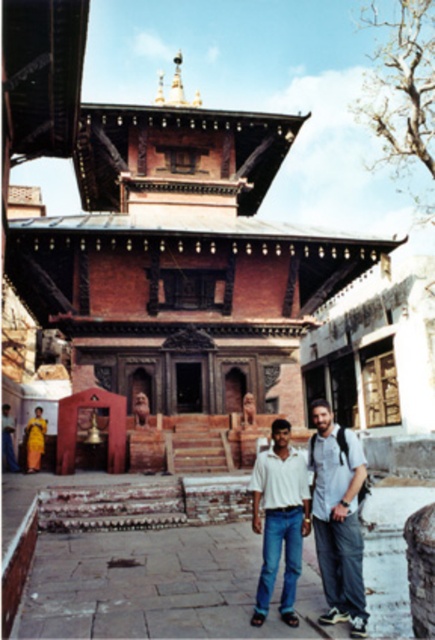
Is white cotton shirt at lower center closer to the viewer compared to yellow silk sari at lower left?

Yes, it is.

From the picture: Who is more forward, [283,513] or [44,426]?

Point [283,513] is in front.

Image resolution: width=435 pixels, height=640 pixels. What do you see at coordinates (280, 518) in the screenshot? I see `white cotton shirt at lower center` at bounding box center [280, 518].

Find the location of `white cotton shirt at lower center`. white cotton shirt at lower center is located at coordinates (280, 518).

Is brown brick temple at center taller than yellow silk sari at lower left?

Indeed, brown brick temple at center has a greater height compared to yellow silk sari at lower left.

Who is shorter, brown brick temple at center or yellow silk sari at lower left?

yellow silk sari at lower left

This screenshot has height=640, width=435. What are the coordinates of `brown brick temple at center` in the screenshot? It's located at (181, 259).

Find the location of a particular element. This screenshot has height=640, width=435. brown brick temple at center is located at coordinates (181, 259).

Is brown brick temple at center above white cotton shirt at lower center?

Yes.

Measure the distance between brown brick temple at center and white cotton shirt at lower center.

A distance of 24.94 meters exists between brown brick temple at center and white cotton shirt at lower center.

Between point (127, 211) and point (304, 474), which one is positioned behind?

Point (127, 211)

I want to click on brown brick temple at center, so click(x=181, y=259).